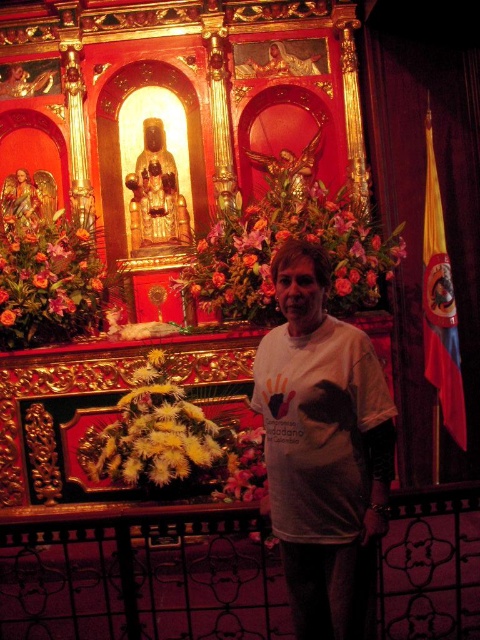
Question: Which of the following is the closest to the observer?

Choices:
 (A) floral bouquet at center
 (B) orange floral bouquet at left
 (C) white cotton t-shirt at center
 (D) white fluffy flowers at lower left

Answer: (C)

Question: Which of these objects is positioned farthest from the floral bouquet at center?

Choices:
 (A) orange floral bouquet at left
 (B) white fluffy flowers at lower left
 (C) white cotton t-shirt at center

Answer: (C)

Question: Does floral bouquet at center have a lesser width compared to white fluffy flowers at lower left?

Choices:
 (A) no
 (B) yes

Answer: (B)

Question: Is white cotton t-shirt at center to the left of white fluffy flowers at lower left from the viewer's perspective?

Choices:
 (A) yes
 (B) no

Answer: (B)

Question: Can you confirm if floral bouquet at center is positioned to the left of white fluffy flowers at lower left?

Choices:
 (A) no
 (B) yes

Answer: (A)

Question: Which object is farther from the camera taking this photo?

Choices:
 (A) orange floral bouquet at left
 (B) white cotton t-shirt at center
 (C) floral bouquet at center
 (D) white fluffy flowers at lower left

Answer: (C)